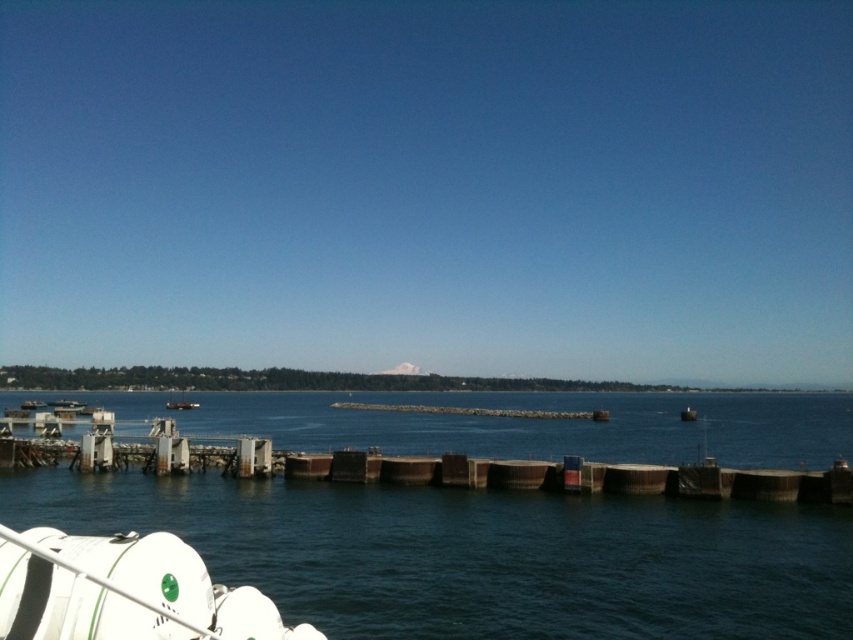
From the picture: You are a photographer standing on the dock and want to capture both the dark blue water at center and the metallic gray boat at center in your shot. Which object appears larger in the photo?

The dark blue water at center appears larger in the photo because it is much taller than the metallic gray boat at center.

You are a photographer planning to capture the dark blue water at center and the metallic gray boat at center in a single frame. Which object should you focus on first if you want to include both in your shot without zooming in or out?

The dark blue water at center has a larger size compared to metallic gray boat at center, so you should focus on the dark blue water at center first to ensure it fits properly in the frame before adjusting for the smaller metallic gray boat at center.